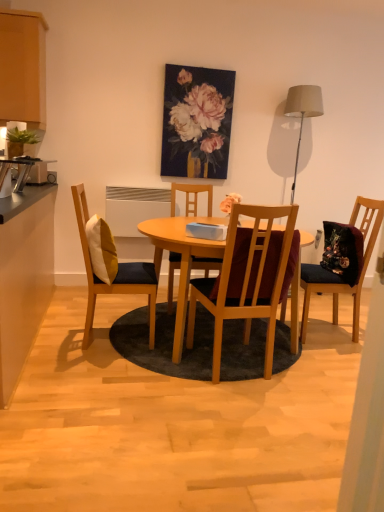
In order to click on free space in front of light wood table at center in this screenshot , I will do `click(176, 429)`.